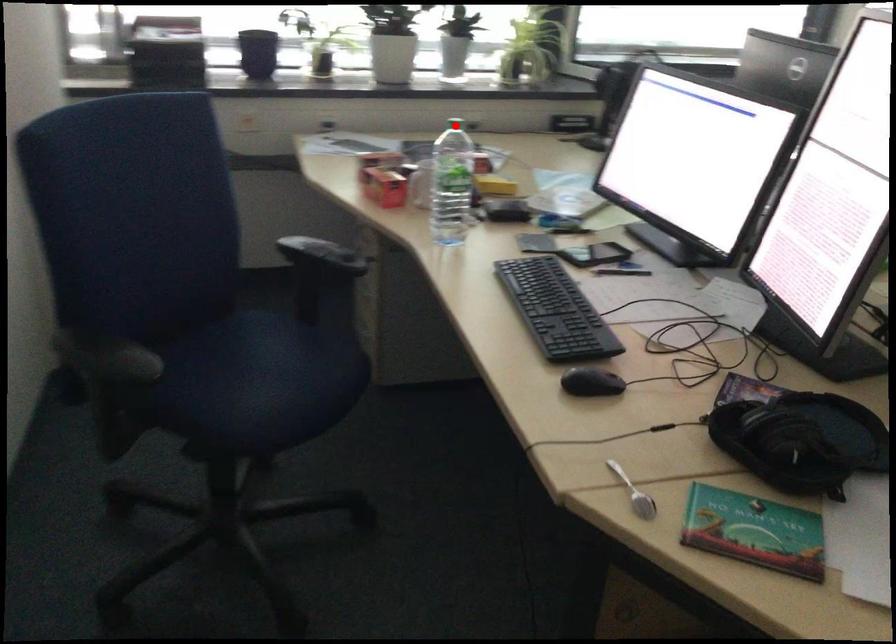
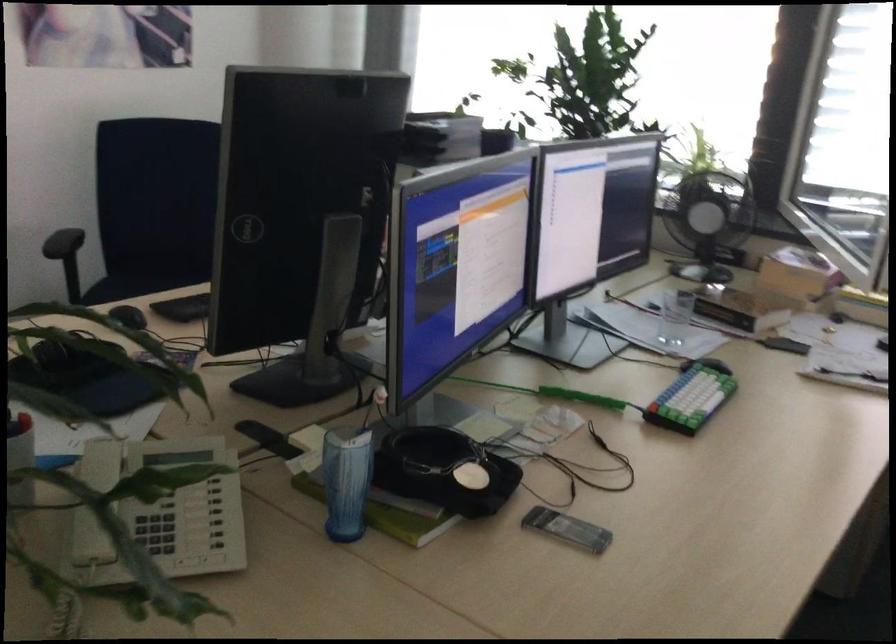
Question: I am providing you with two images of the same scene from different viewpoints. A red point is marked on the first image. At the location where the point appears in image 1, is it still visible in image 2?

Choices:
 (A) Yes
 (B) No

Answer: (B)